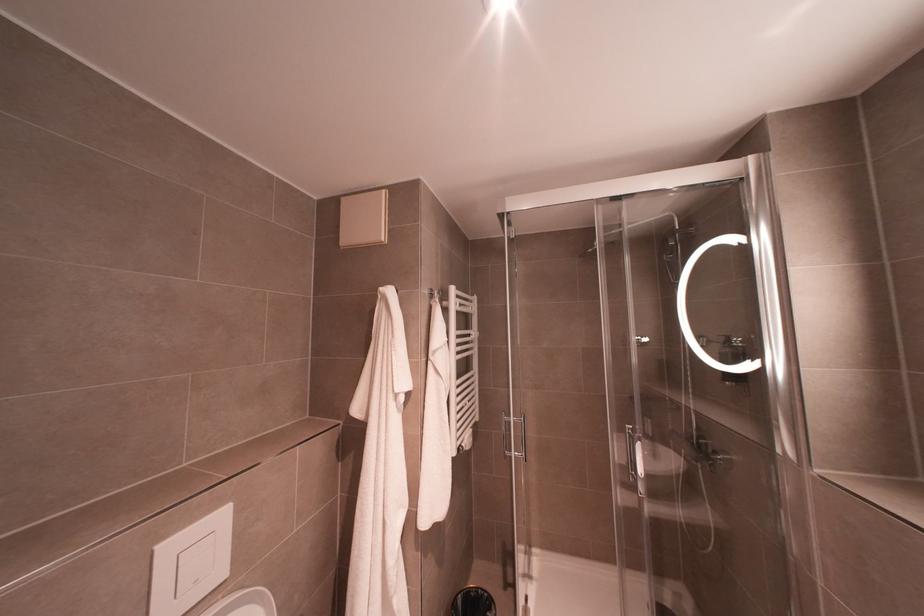
Find where to push the toilet flush button. Please return your answer as a coordinate pair (x, y).

(196, 562)